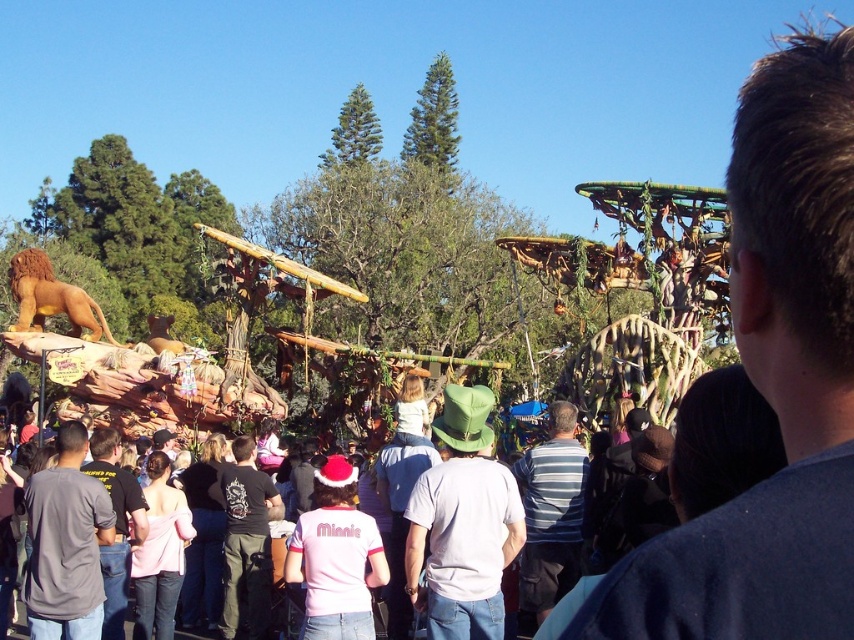
Question: Is green felt hat at center wider than black cotton shirt at center?

Choices:
 (A) yes
 (B) no

Answer: (A)

Question: Where is dark brown hair at upper right located in relation to striped cotton shirt at center in the image?

Choices:
 (A) left
 (B) right

Answer: (B)

Question: Which object is farther from the camera taking this photo?

Choices:
 (A) green felt hat at center
 (B) black cotton shirt at center

Answer: (B)

Question: Considering the real-world distances, which object is farthest from the black cotton shirt at center?

Choices:
 (A) striped cotton shirt at center
 (B) light pink fabric crowd at center

Answer: (A)

Question: Which point is farther to the camera?

Choices:
 (A) dark gray shirt at center
 (B) black cotton shirt at center
 (C) striped cotton shirt at center

Answer: (B)

Question: Is gray cotton shirt at lower left above black cotton shirt at center?

Choices:
 (A) yes
 (B) no

Answer: (A)